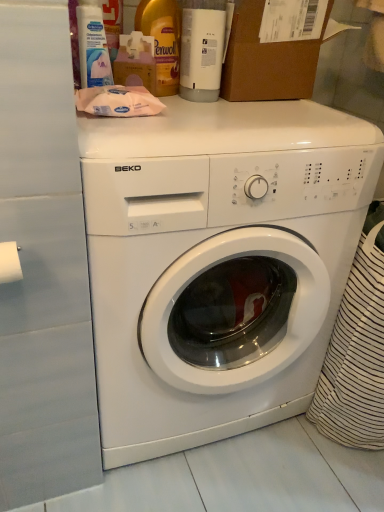
Where is `vacant space in front of white plastic bottle at upper center, which ranks as the first bottle in right-to-left order`? vacant space in front of white plastic bottle at upper center, which ranks as the first bottle in right-to-left order is located at coordinates (210, 112).